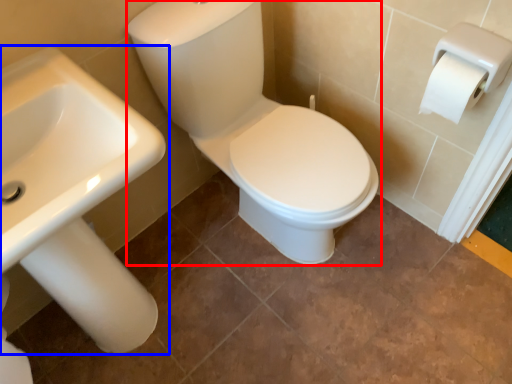
Question: Among these objects, which one is farthest to the camera, sit (highlighted by a red box) or sink (highlighted by a blue box)?

Choices:
 (A) sit
 (B) sink

Answer: (A)